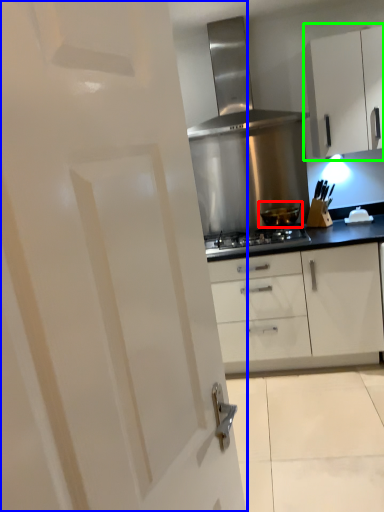
Question: Which object is the farthest from kitchen appliance (highlighted by a red box)? Choose among these: door (highlighted by a blue box) or cabinetry (highlighted by a green box).

Choices:
 (A) door
 (B) cabinetry

Answer: (A)